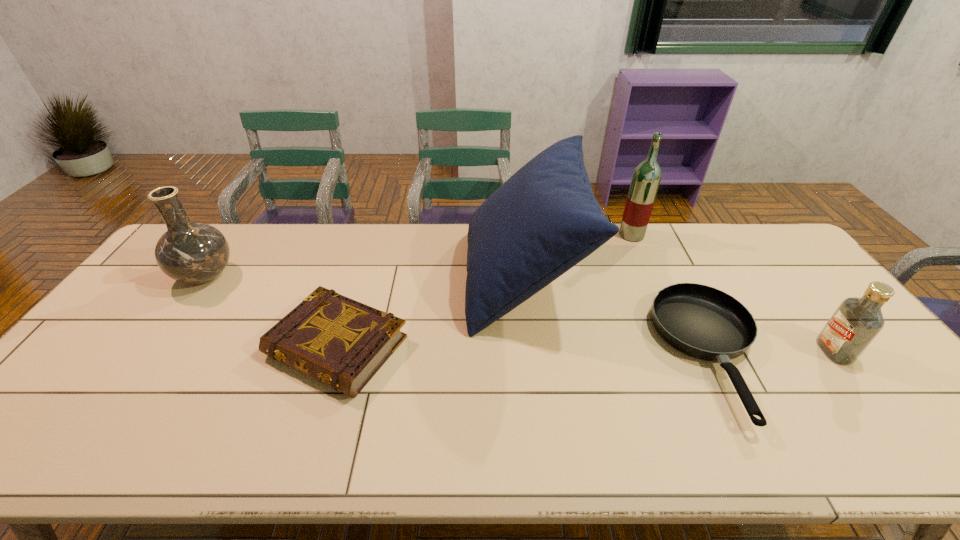
This screenshot has width=960, height=540. What are the coordinates of `liquor` in the screenshot? It's located at (646, 178).

At what (x,y) coordinates should I click in order to perform the action: click on the third object from left to right. Please return your answer as a coordinate pair (x, y). Looking at the image, I should click on (541, 222).

Identify the location of the third tallest object. (189, 252).

Locate an element on the screen. The image size is (960, 540). vase is located at coordinates (189, 252).

Identify the location of vodka. (856, 322).

Locate an element on the screen. Image resolution: width=960 pixels, height=540 pixels. the rightmost object is located at coordinates (856, 322).

Where is `the second shortest object`? The height and width of the screenshot is (540, 960). the second shortest object is located at coordinates (342, 343).

Identify the location of hardback book. (342, 343).

I want to click on frying pan, so click(x=703, y=322).

At what (x,y) coordinates should I click in order to perform the action: click on vacant region located 0.100m on the front of the liquor. Please return your answer as a coordinate pair (x, y). Image resolution: width=960 pixels, height=540 pixels. Looking at the image, I should click on (642, 260).